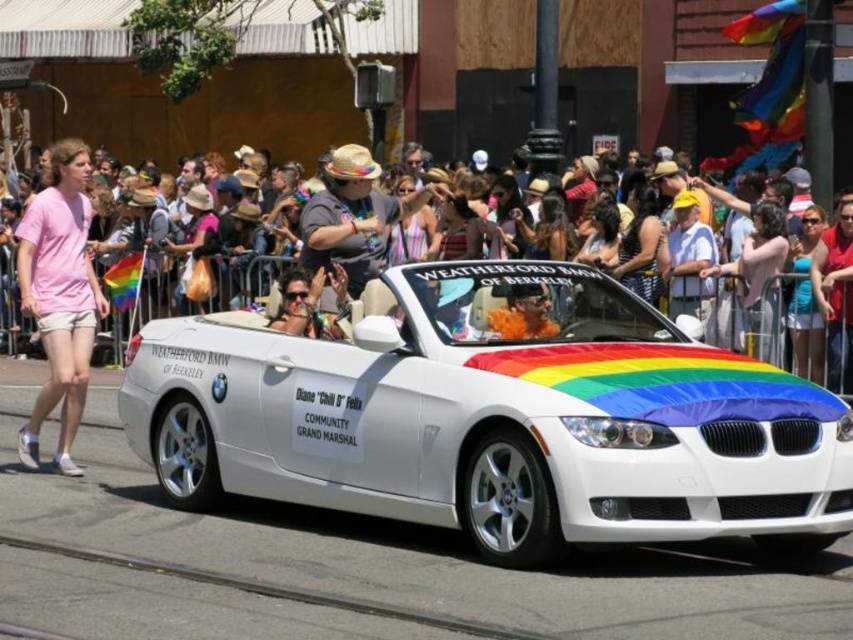
Question: Estimate the real-world distances between objects in this image. Which object is closer to the rainbow fabric crowd at center?

Choices:
 (A) orange fuzzy hat at center
 (B) pink cotton t-shirt at left
 (C) white metallic convertible at center

Answer: (B)

Question: Considering the real-world distances, which object is closest to the pink cotton t-shirt at left?

Choices:
 (A) white metallic convertible at center
 (B) rainbow fabric crowd at center
 (C) orange fuzzy hat at center

Answer: (A)

Question: Is pink cotton t-shirt at left in front of rainbow fabric crowd at center?

Choices:
 (A) no
 (B) yes

Answer: (B)

Question: Is white metallic convertible at center thinner than orange fuzzy hat at center?

Choices:
 (A) yes
 (B) no

Answer: (B)

Question: Does pink cotton t-shirt at left have a larger size compared to orange fuzzy hat at center?

Choices:
 (A) yes
 (B) no

Answer: (A)

Question: Which point appears farthest from the camera in this image?

Choices:
 (A) (589, 314)
 (B) (38, 237)
 (C) (506, 298)

Answer: (B)